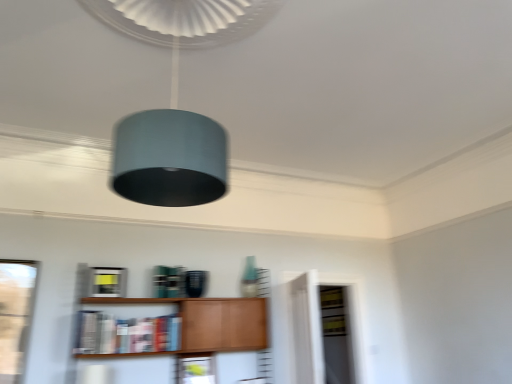
What do you see at coordinates (325, 332) in the screenshot? The width and height of the screenshot is (512, 384). I see `transparent glass door at center` at bounding box center [325, 332].

Describe the element at coordinates (126, 334) in the screenshot. I see `hardcover book at center` at that location.

Measure the distance between wooden shelf at lower center and camera.

11.07 feet.

Find the location of a particular element. Image resolution: width=512 pixels, height=384 pixels. teal fabric lampshade at upper center is located at coordinates (175, 100).

Considering the relative sizes of hardcover book at center and transparent glass door at center in the image provided, is hardcover book at center taller than transparent glass door at center?

No, hardcover book at center is not taller than transparent glass door at center.

Which object is positioned more to the left, hardcover book at center or transparent glass door at center?

Positioned to the left is hardcover book at center.

Is hardcover book at center oriented away from transparent glass door at center?

No.

Based on their sizes in the image, would you say hardcover book at center is bigger or smaller than transparent glass door at center?

Clearly, hardcover book at center is smaller in size than transparent glass door at center.

Is matte wood cabinet at lower center oriented away from teal fabric lampshade at upper center?

No, matte wood cabinet at lower center is not facing the opposite direction of teal fabric lampshade at upper center.

Which of these two, matte wood cabinet at lower center or teal fabric lampshade at upper center, stands taller?

teal fabric lampshade at upper center is taller.

Considering the positions of objects matte wood cabinet at lower center and teal fabric lampshade at upper center in the image provided, who is behind, matte wood cabinet at lower center or teal fabric lampshade at upper center?

matte wood cabinet at lower center is further away from the camera.

Which of these two, matte wood cabinet at lower center or teal fabric lampshade at upper center, is bigger?

Bigger between the two is teal fabric lampshade at upper center.

From the picture: From the image's perspective, who appears lower, teal fabric lampshade at upper center or transparent glass door at center?

transparent glass door at center.

Is teal fabric lampshade at upper center bigger than transparent glass door at center?

Yes, teal fabric lampshade at upper center is bigger than transparent glass door at center.

Is teal fabric lampshade at upper center in contact with transparent glass door at center?

teal fabric lampshade at upper center and transparent glass door at center are clearly separated.

From a real-world perspective, is transparent glass door at center positioned over teal fabric lampshade at upper center based on gravity?

Incorrect, from a real-world perspective, transparent glass door at center is lower than teal fabric lampshade at upper center.

I want to click on lamp that is in front of the transparent glass door at center, so click(175, 100).

From the picture: From the image's perspective, would you say transparent glass door at center is shown under teal fabric lampshade at upper center?

Yes, from the image's perspective, transparent glass door at center is below teal fabric lampshade at upper center.

Which object is wider, hardcover book at center or teal fabric lampshade at upper center?

With larger width is teal fabric lampshade at upper center.

Would you say hardcover book at center is a long distance from teal fabric lampshade at upper center?

Indeed, hardcover book at center is not near teal fabric lampshade at upper center.

Could teal fabric lampshade at upper center be considered to be inside hardcover book at center?

Actually, teal fabric lampshade at upper center is outside hardcover book at center.

Considering the points (119, 330) and (124, 159), which point is behind, point (119, 330) or point (124, 159)?

The point (119, 330) is more distant.

Identify the location of glass door behind the hardcover book at center. Image resolution: width=512 pixels, height=384 pixels. (325, 332).

From a real-world perspective, is transparent glass door at center positioned above or below hardcover book at center?

From a real-world perspective, transparent glass door at center is physically below hardcover book at center.

Is transparent glass door at center smaller than hardcover book at center?

No, transparent glass door at center is not smaller than hardcover book at center.

How far apart are transparent glass door at center and hardcover book at center?

transparent glass door at center and hardcover book at center are 6.45 feet apart.

From a real-world perspective, between transparent glass door at center and wooden shelf at lower center, who is vertically higher?

In real-world perspective, transparent glass door at center is above.

Considering the relative positions of transparent glass door at center and wooden shelf at lower center in the image provided, is transparent glass door at center to the right of wooden shelf at lower center from the viewer's perspective?

Indeed, transparent glass door at center is positioned on the right side of wooden shelf at lower center.

Where is `glass door on the right of wooden shelf at lower center`? This screenshot has width=512, height=384. glass door on the right of wooden shelf at lower center is located at coordinates (325, 332).

From the picture: From the image's perspective, is transparent glass door at center above or below wooden shelf at lower center?

Clearly, from the image's perspective, transparent glass door at center is below wooden shelf at lower center.

Where is `book above the transparent glass door at center (from a real-world perspective)`? The width and height of the screenshot is (512, 384). book above the transparent glass door at center (from a real-world perspective) is located at coordinates (126, 334).

The height and width of the screenshot is (384, 512). I want to click on cabinetry that is on the left side of teal fabric lampshade at upper center, so click(x=106, y=282).

Looking at the image, which one is located further to teal fabric lampshade at upper center, wooden shelf at lower center or transparent glass door at center?

Among the two, transparent glass door at center is located further to teal fabric lampshade at upper center.

Considering their positions, is teal fabric lampshade at upper center positioned closer to transparent glass door at center than hardcover book at center?

hardcover book at center is positioned closer to the anchor transparent glass door at center.

From the image, which object appears to be farther from teal fabric lampshade at upper center, matte wood cabinet at lower center or hardcover book at center?

Based on the image, matte wood cabinet at lower center appears to be further to teal fabric lampshade at upper center.

Which object lies nearer to the anchor point hardcover book at center, teal fabric lampshade at upper center or transparent glass door at center?

Based on the image, teal fabric lampshade at upper center appears to be nearer to hardcover book at center.

When comparing their distances from wooden shelf at lower center, does matte wood cabinet at lower center or transparent glass door at center seem closer?

The object closer to wooden shelf at lower center is matte wood cabinet at lower center.

Looking at this image, looking at the image, which one is located closer to matte wood cabinet at lower center, hardcover book at center or transparent glass door at center?

Among the two, hardcover book at center is located nearer to matte wood cabinet at lower center.

Which object lies nearer to the anchor point matte wood cabinet at lower center, wooden shelf at lower center or hardcover book at center?

hardcover book at center is positioned closer to the anchor matte wood cabinet at lower center.

Based on their spatial positions, is transparent glass door at center or teal fabric lampshade at upper center closer to wooden shelf at lower center?

The object closer to wooden shelf at lower center is transparent glass door at center.

Locate an element on the screen. The image size is (512, 384). shelf located between matte wood cabinet at lower center and transparent glass door at center in the left-right direction is located at coordinates (211, 322).

Identify the location of book between teal fabric lampshade at upper center and transparent glass door at center along the z-axis. The width and height of the screenshot is (512, 384). (126, 334).

Where is `cabinetry between teal fabric lampshade at upper center and transparent glass door at center along the z-axis`? The height and width of the screenshot is (384, 512). cabinetry between teal fabric lampshade at upper center and transparent glass door at center along the z-axis is located at coordinates (106, 282).

Where is `book located between matte wood cabinet at lower center and wooden shelf at lower center in the left-right direction`? The height and width of the screenshot is (384, 512). book located between matte wood cabinet at lower center and wooden shelf at lower center in the left-right direction is located at coordinates (126, 334).